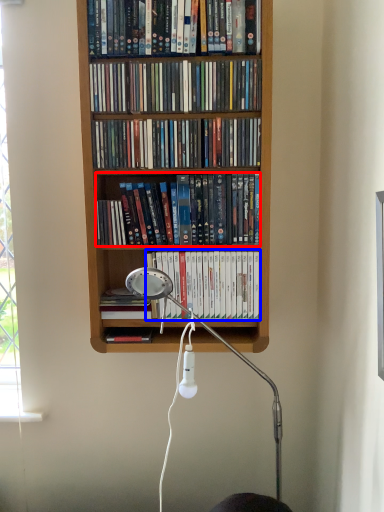
Question: Which object is closer to the camera taking this photo, book (highlighted by a red box) or book (highlighted by a blue box)?

Choices:
 (A) book
 (B) book

Answer: (A)